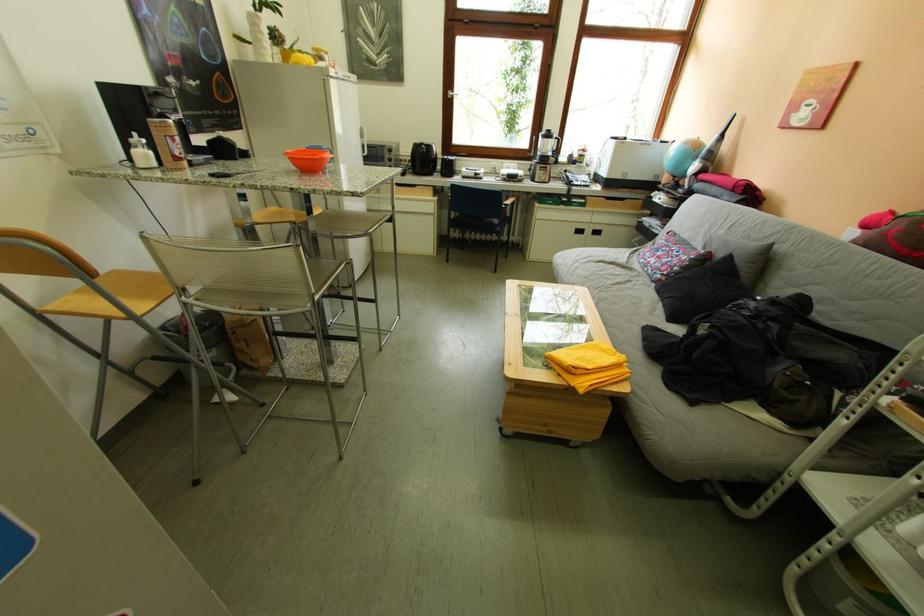
Describe the element at coordinates (126, 286) in the screenshot. The width and height of the screenshot is (924, 616). I see `the yellow chair sitting surface` at that location.